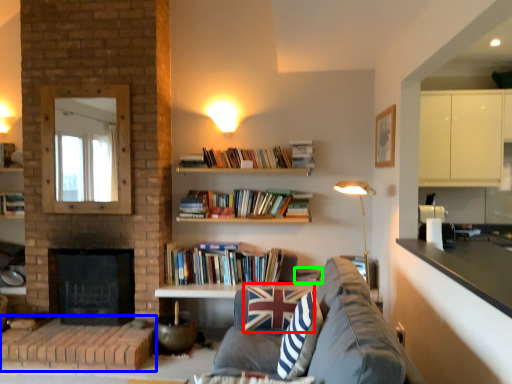
Question: Considering the real-world distances, which object is closest to pillow (highlighted by a red box)? brickwork (highlighted by a blue box) or book (highlighted by a green box).

Choices:
 (A) brickwork
 (B) book

Answer: (B)